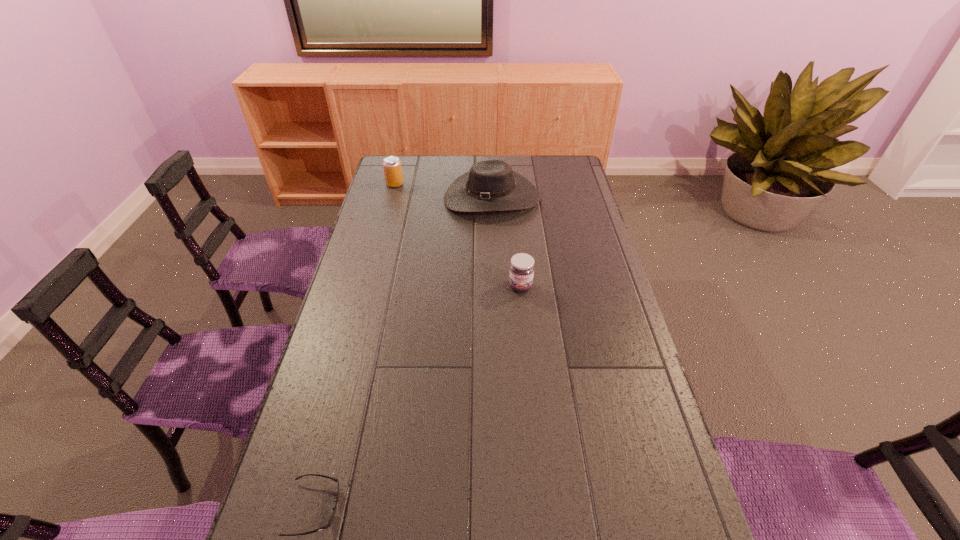
Locate an element on the screen. This screenshot has width=960, height=540. the tallest object is located at coordinates (491, 185).

Image resolution: width=960 pixels, height=540 pixels. Identify the location of pop (soda). (392, 167).

I want to click on jam, so click(x=521, y=272).

At what (x,y) coordinates should I click in order to perform the action: click on the nearest object. Please return your answer as a coordinate pair (x, y). The image size is (960, 540). Looking at the image, I should click on (336, 480).

Identify the location of the shortest object. (336, 480).

At what (x,y) coordinates should I click in order to perform the action: click on blank space located on the front-facing side of the cowboy hat. Please return your answer as a coordinate pair (x, y). Image resolution: width=960 pixels, height=540 pixels. Looking at the image, I should click on (494, 270).

Identify the location of vacant region located 0.350m on the right of the pop (soda). click(484, 184).

Find the location of a particular element. Image resolution: width=960 pixels, height=540 pixels. vacant space located on the front label of the second nearest object is located at coordinates (525, 333).

I want to click on vacant area situated 0.220m on the front-facing side of the shortest object, so click(x=442, y=508).

Locate an element on the screen. cowboy hat located in the far edge section of the desktop is located at coordinates (491, 185).